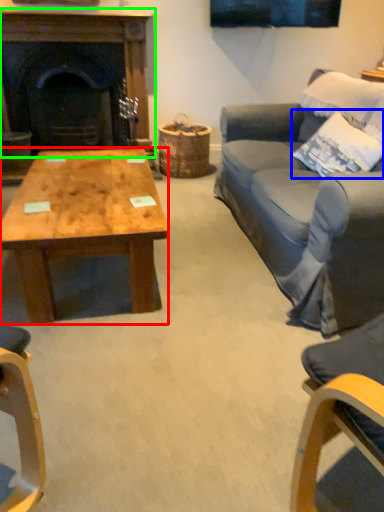
Question: Based on their relative distances, which object is nearer to coffee table (highlighted by a red box)? Choose from pillow (highlighted by a blue box) and fireplace (highlighted by a green box).

Choices:
 (A) pillow
 (B) fireplace

Answer: (A)